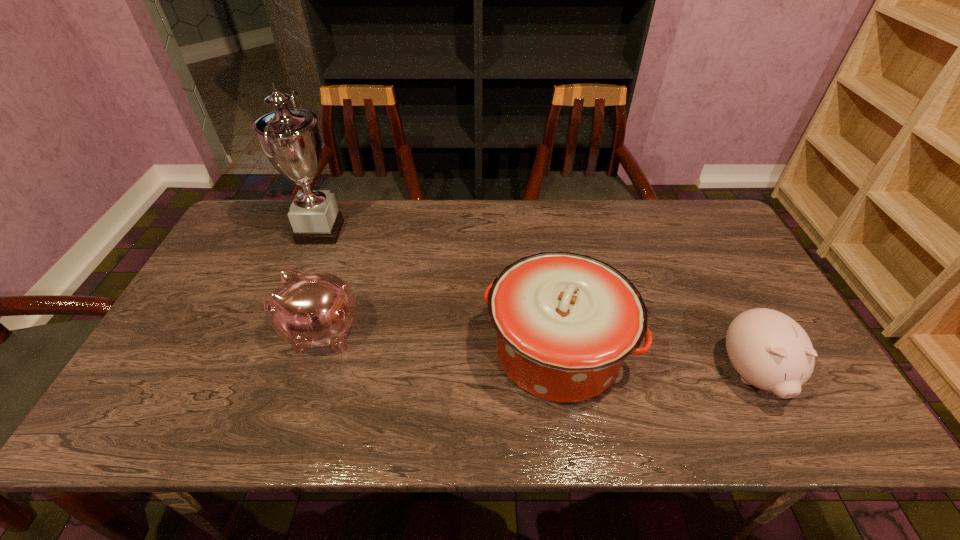
Identify the location of vacant space at the far left corner of the desktop. (268, 200).

This screenshot has width=960, height=540. Identify the location of free space at the far right corner. (708, 220).

The width and height of the screenshot is (960, 540). In the image, there is a desktop. What are the coordinates of `free space at the near right corner` in the screenshot? It's located at (825, 433).

I want to click on free space between the casserole and the rightmost object, so click(655, 363).

Image resolution: width=960 pixels, height=540 pixels. Identify the location of free spot between the casserole and the left piggy bank. (439, 342).

The width and height of the screenshot is (960, 540). I want to click on free spot between the casserole and the right piggy bank, so click(x=655, y=363).

Image resolution: width=960 pixels, height=540 pixels. Find the location of `vacant space that's between the second object from right to left and the left piggy bank`. vacant space that's between the second object from right to left and the left piggy bank is located at coordinates (439, 342).

I want to click on vacant space that is in between the casserole and the right piggy bank, so click(x=655, y=363).

The width and height of the screenshot is (960, 540). What are the coordinates of `the closest object relative to the rightmost object` in the screenshot? It's located at (565, 322).

This screenshot has height=540, width=960. Find the location of `the third closest object relative to the casserole`. the third closest object relative to the casserole is located at coordinates (290, 138).